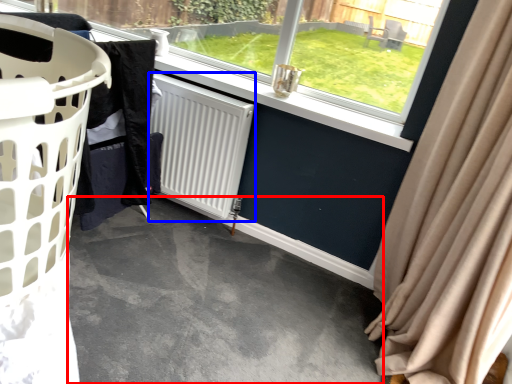
Question: Which object appears farthest to the camera in this image, concrete (highlighted by a red box) or radiator (highlighted by a blue box)?

Choices:
 (A) concrete
 (B) radiator

Answer: (B)